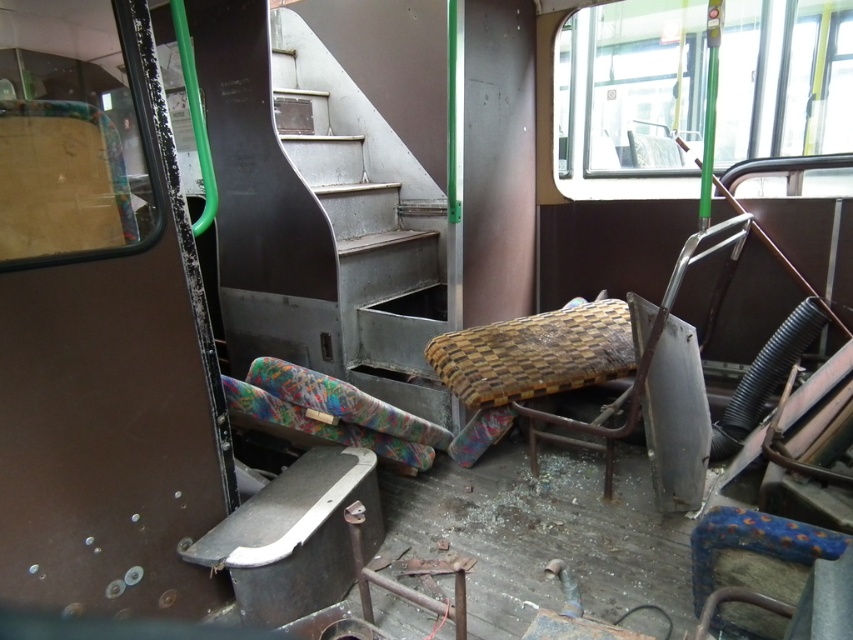
You are a person who needs to sit down. You see a woven fabric chair at center and a multicolored fabric pillow at lower left. Which one is bigger in size?

The woven fabric chair at center is larger in size compared to the multicolored fabric pillow at lower left.

You are trying to navigate through the abandoned bus interior. You see a woven fabric chair at center and a multicolored fabric pillow at lower left. Which object has a larger width?

The woven fabric chair at center might be wider than the multicolored fabric pillow at lower left, so it is likely the wider object between the two.

You are navigating through the abandoned bus and need to move from the multicolored fabric pillow at lower left to the woven fabric chair at center. Which direction should you move in?

You should move to the right to reach the woven fabric chair at center from the multicolored fabric pillow at lower left.